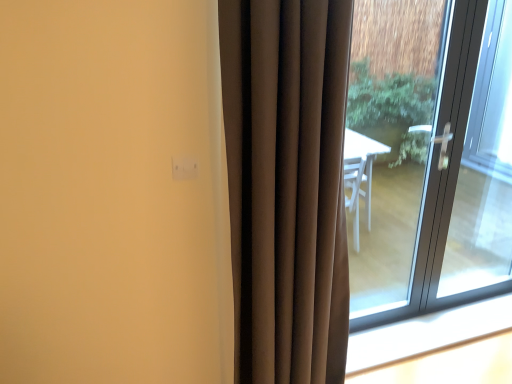
This screenshot has height=384, width=512. I want to click on clear glass door at right, so (480, 167).

At what (x,y) coordinates should I click in order to perform the action: click on transparent glass door at right. Please return your answer as a coordinate pair (x, y). Image resolution: width=512 pixels, height=384 pixels. Looking at the image, I should click on (443, 176).

Locate an element on the screen. white plastic window sill at lower right is located at coordinates (426, 333).

Could you tell me if white plastic window sill at lower right is turned towards transparent glass door at right?

No, white plastic window sill at lower right does not turn towards transparent glass door at right.

From a real-world perspective, relative to transparent glass door at right, is white plastic window sill at lower right vertically above or below?

Clearly, from a real-world perspective, white plastic window sill at lower right is below transparent glass door at right.

Is white plastic window sill at lower right smaller than transparent glass door at right?

Yes.

In terms of height, does white plastic window sill at lower right look taller or shorter compared to transparent glass door at right?

white plastic window sill at lower right is shorter than transparent glass door at right.

At what (x,y) coordinates should I click in order to perform the action: click on curtain located above the white plastic window sill at lower right (from the image's perspective). Please return your answer as a coordinate pair (x, y). The image size is (512, 384). Looking at the image, I should click on (287, 186).

Based on the photo, is brown velvet curtain at center located within white plastic window sill at lower right?

No, brown velvet curtain at center is located outside of white plastic window sill at lower right.

Does white plastic window sill at lower right have a greater width compared to brown velvet curtain at center?

Yes, white plastic window sill at lower right is wider than brown velvet curtain at center.

Is white plastic window sill at lower right smaller than brown velvet curtain at center?

Correct, white plastic window sill at lower right occupies less space than brown velvet curtain at center.

Is the surface of brown velvet curtain at center in direct contact with transparent glass door at right?

brown velvet curtain at center and transparent glass door at right are not in contact.

Is brown velvet curtain at center closer to camera compared to transparent glass door at right?

Yes, it is.

Is point (245, 68) in front of point (454, 91)?

Yes, point (245, 68) is in front of point (454, 91).

Which is more to the right, brown velvet curtain at center or transparent glass door at right?

transparent glass door at right.

Is white plastic window sill at lower right closer to camera compared to clear glass door at right?

No, the depth of white plastic window sill at lower right is greater than that of clear glass door at right.

Is white plastic window sill at lower right in contact with clear glass door at right?

No, white plastic window sill at lower right is not beside clear glass door at right.

Which of these two, white plastic window sill at lower right or clear glass door at right, is smaller?

Smaller between the two is white plastic window sill at lower right.

At what (x,y) coordinates should I click in order to perform the action: click on screen door in front of the white plastic window sill at lower right. Please return your answer as a coordinate pair (x, y). This screenshot has height=384, width=512. Looking at the image, I should click on pos(480,167).

Which point is more forward, (279, 57) or (482, 193)?

The point (279, 57) is in front.

Does brown velvet curtain at center have a lesser width compared to clear glass door at right?

No, brown velvet curtain at center is not thinner than clear glass door at right.

Is brown velvet curtain at center located outside clear glass door at right?

Indeed, brown velvet curtain at center is completely outside clear glass door at right.

How much distance is there between brown velvet curtain at center and clear glass door at right?

brown velvet curtain at center is 3.92 feet away from clear glass door at right.

Is brown velvet curtain at center further to the viewer compared to white plastic window sill at lower right?

No.

Can you confirm if brown velvet curtain at center is thinner than white plastic window sill at lower right?

Yes.

Is white plastic window sill at lower right at the back of brown velvet curtain at center?

brown velvet curtain at center does not have its back to white plastic window sill at lower right.

Is white plastic window sill at lower right completely or partially inside brown velvet curtain at center?

No, brown velvet curtain at center does not contain white plastic window sill at lower right.

Is transparent glass door at right not near white plastic window sill at lower right?

Actually, transparent glass door at right and white plastic window sill at lower right are a little close together.

Is the position of transparent glass door at right less distant than that of white plastic window sill at lower right?

Yes, it is in front of white plastic window sill at lower right.

Can you confirm if transparent glass door at right is positioned to the right of white plastic window sill at lower right?

Incorrect, transparent glass door at right is not on the right side of white plastic window sill at lower right.

Which is closer to the camera, (477, 57) or (389, 353)?

The point (477, 57) is in front.

Find the location of a particular element. This screenshot has width=512, height=384. window that is on the left side of white plastic window sill at lower right is located at coordinates (443, 176).

Find the location of a particular element. curtain above the white plastic window sill at lower right (from a real-world perspective) is located at coordinates (287, 186).

Which object lies nearer to the anchor point white plastic window sill at lower right, brown velvet curtain at center or clear glass door at right?

clear glass door at right is positioned closer to the anchor white plastic window sill at lower right.

From the image, which object appears to be farther from clear glass door at right, brown velvet curtain at center or white plastic window sill at lower right?

brown velvet curtain at center lies further to clear glass door at right than the other object.

From the image, which object appears to be farther from brown velvet curtain at center, white plastic window sill at lower right or clear glass door at right?

clear glass door at right is further to brown velvet curtain at center.

Which object lies further to the anchor point clear glass door at right, white plastic window sill at lower right or brown velvet curtain at center?

The object further to clear glass door at right is brown velvet curtain at center.

When comparing their distances from transparent glass door at right, does clear glass door at right or brown velvet curtain at center seem closer?

The object closer to transparent glass door at right is clear glass door at right.

Consider the image. Looking at the image, which one is located further to transparent glass door at right, clear glass door at right or white plastic window sill at lower right?

white plastic window sill at lower right.

Based on the photo, estimate the real-world distances between objects in this image. Which object is closer to white plastic window sill at lower right, clear glass door at right or transparent glass door at right?

Among the two, transparent glass door at right is located nearer to white plastic window sill at lower right.

Looking at the image, which one is located further to white plastic window sill at lower right, brown velvet curtain at center or transparent glass door at right?

Among the two, brown velvet curtain at center is located further to white plastic window sill at lower right.

Locate an element on the screen. window between brown velvet curtain at center and white plastic window sill at lower right along the z-axis is located at coordinates (443, 176).

The image size is (512, 384). What are the coordinates of `window sill situated between brown velvet curtain at center and clear glass door at right from left to right` in the screenshot? It's located at (426, 333).

At what (x,y) coordinates should I click in order to perform the action: click on window between clear glass door at right and white plastic window sill at lower right from top to bottom. Please return your answer as a coordinate pair (x, y). Looking at the image, I should click on (443, 176).

Where is `window situated between brown velvet curtain at center and clear glass door at right from left to right`? window situated between brown velvet curtain at center and clear glass door at right from left to right is located at coordinates (443, 176).